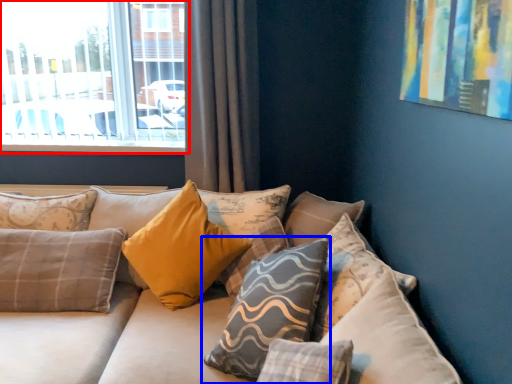
Question: Which object appears farthest to the camera in this image, window (highlighted by a red box) or pillow (highlighted by a blue box)?

Choices:
 (A) window
 (B) pillow

Answer: (A)